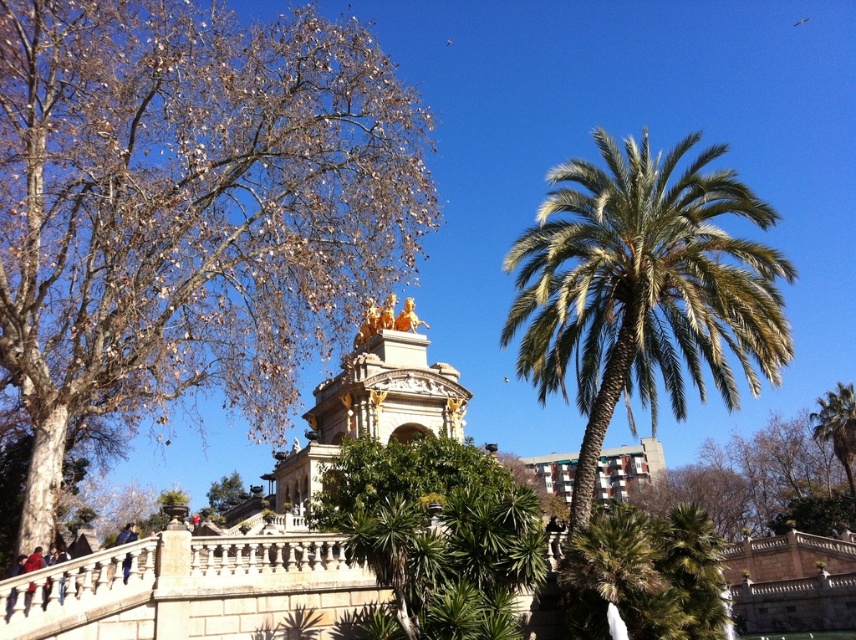
You are standing at the base of the stone staircase leading to the classical building. You notice two points marked in the scene. The first point is at coordinates point [108,384] and the second is at point [539,253]. Which point is closer to you as you stand at the base?

Point [108,384] is closer to the viewer than point [539,253]. Therefore, the first point is closer to you as you stand at the base.

You are standing at the base of the stone staircase leading to the classical building. You notice a brown bark tree at upper left and a green leafy palm at center. Which tree is farther away from you?

The brown bark tree at upper left is farther away from you because it is 86.48 feet away from the green leafy palm at center, which is closer to the staircase.